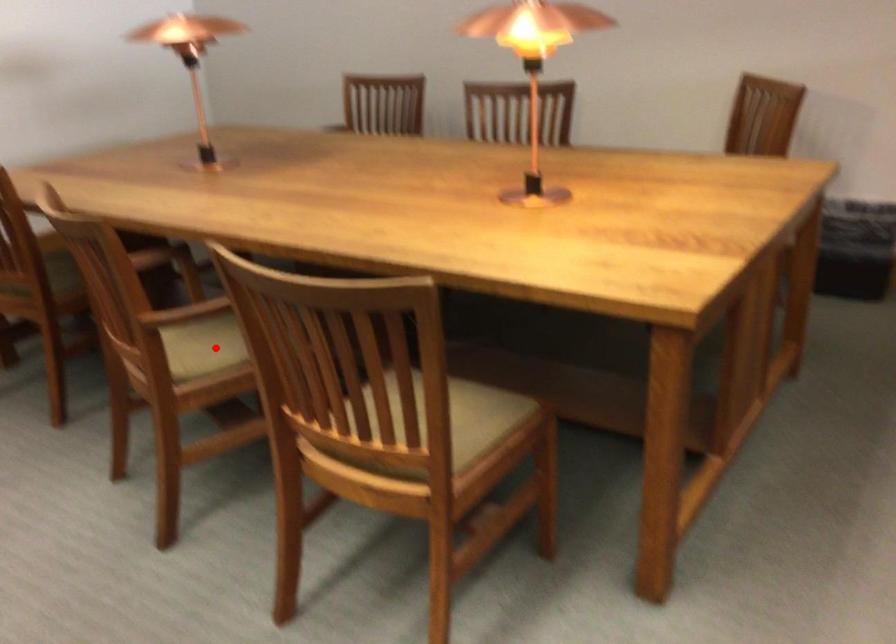
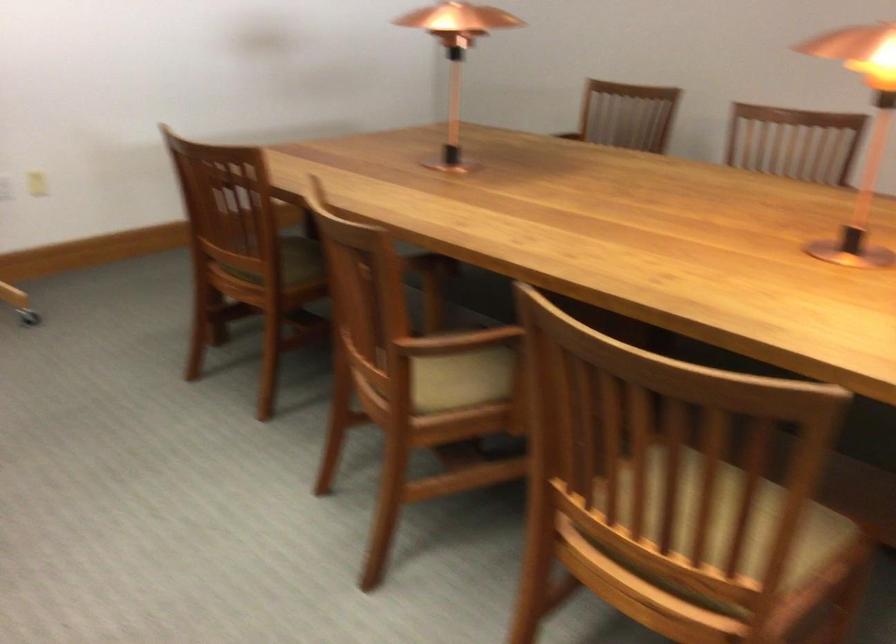
Question: I am providing you with two images of the same scene from different viewpoints. In image1, a red point is highlighted. Considering the same 3D point in image2, which of the following is correct?

Choices:
 (A) It is closer
 (B) It is farther

Answer: (A)